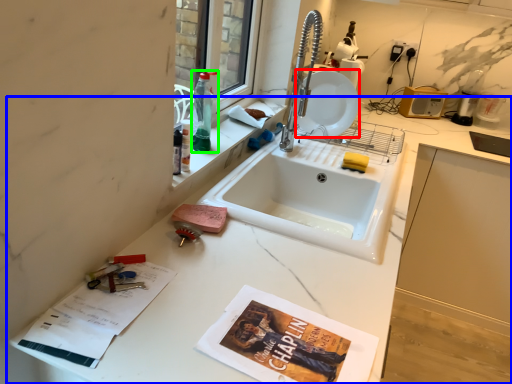
Question: Which object is positioned closest to plate (highlighted by a red box)? Select from countertop (highlighted by a blue box) and bottle (highlighted by a green box).

Choices:
 (A) countertop
 (B) bottle

Answer: (B)